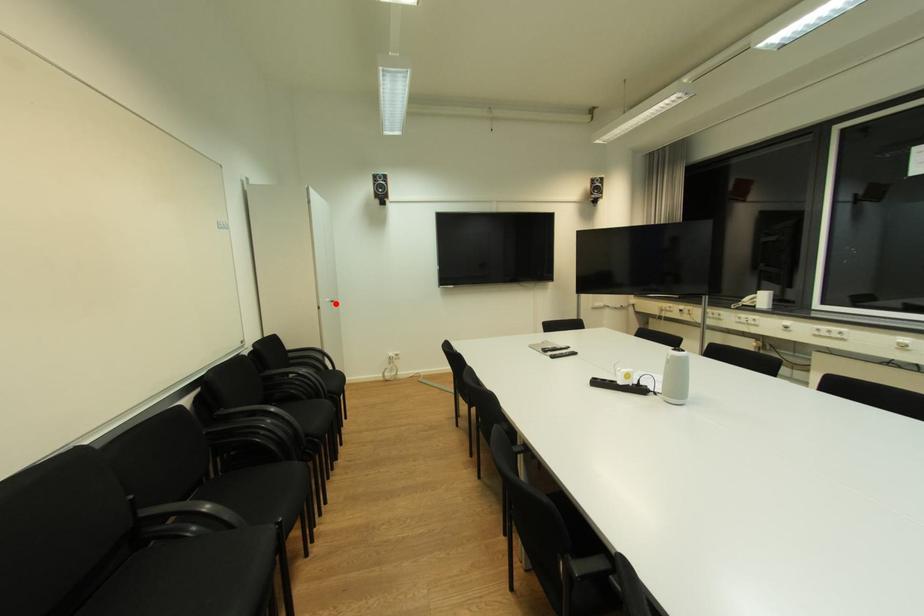
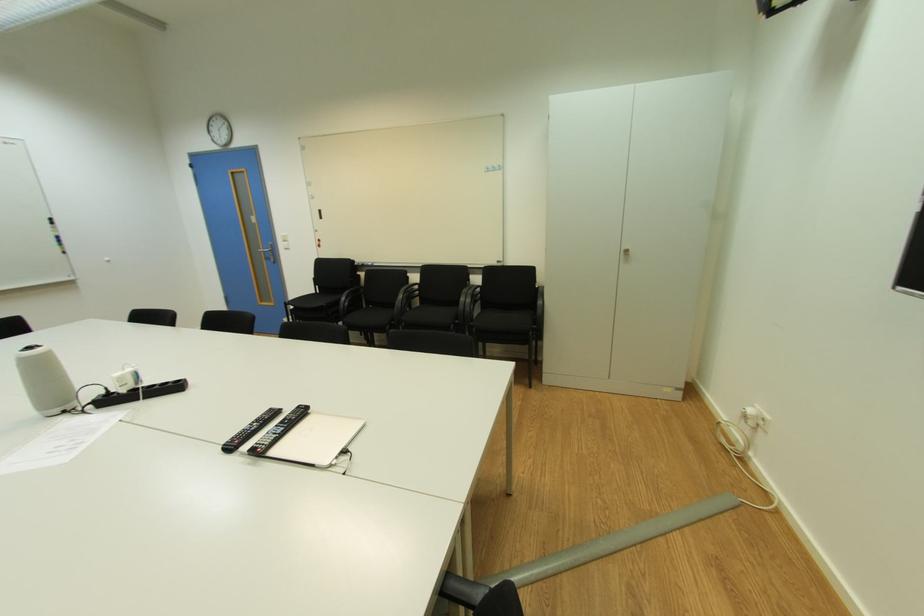
Where in the second image is the point corresponding to the highlighted location from the first image?

(628, 254)